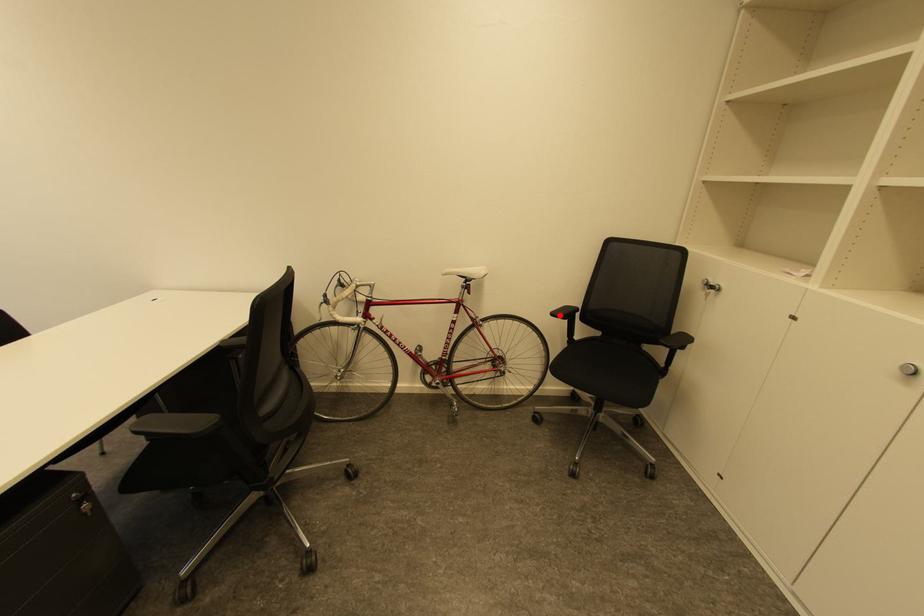
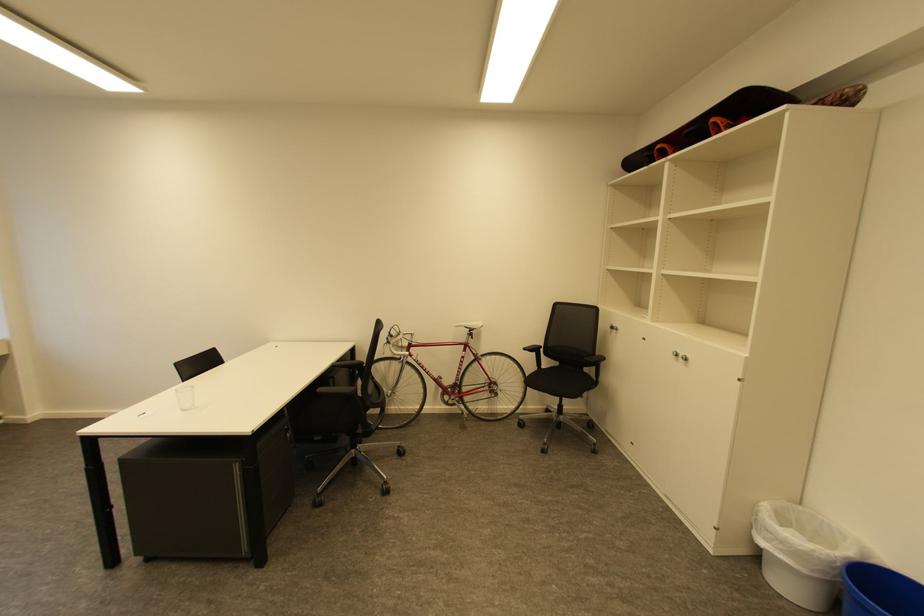
Find the pixel in the second image that matches the highlighted location in the first image.

(531, 350)